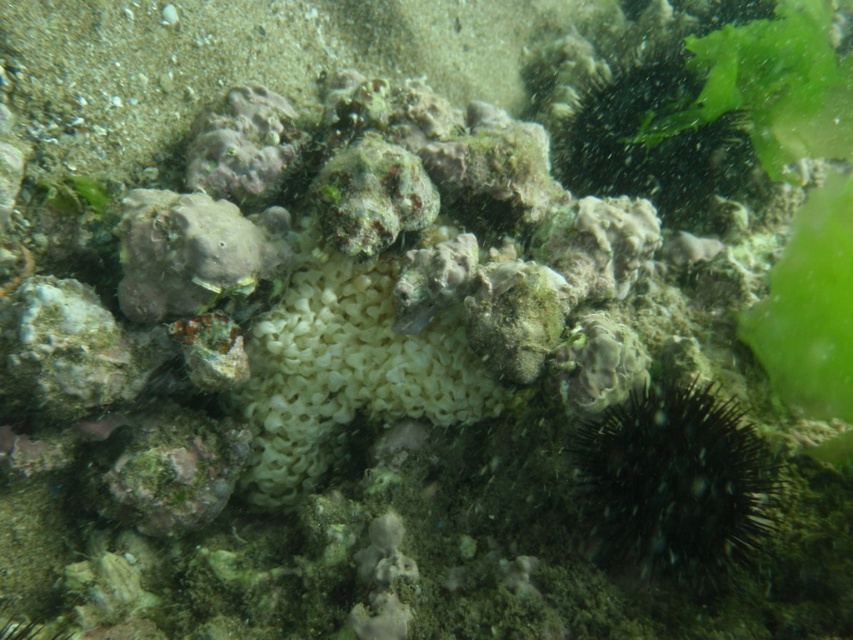
Question: Is black spiny sea urchin at lower right to the right of white sponge at center from the viewer's perspective?

Choices:
 (A) yes
 (B) no

Answer: (A)

Question: Does black spiny sea urchin at lower right appear over white sponge at center?

Choices:
 (A) yes
 (B) no

Answer: (B)

Question: In this image, where is black spiny sea urchin at lower right located relative to white sponge at center?

Choices:
 (A) left
 (B) right

Answer: (B)

Question: Among these objects, which one is nearest to the camera?

Choices:
 (A) white sponge at center
 (B) black spiny sea urchin at lower right

Answer: (B)

Question: Which of the following is the closest to the observer?

Choices:
 (A) (181, 221)
 (B) (584, 440)

Answer: (A)